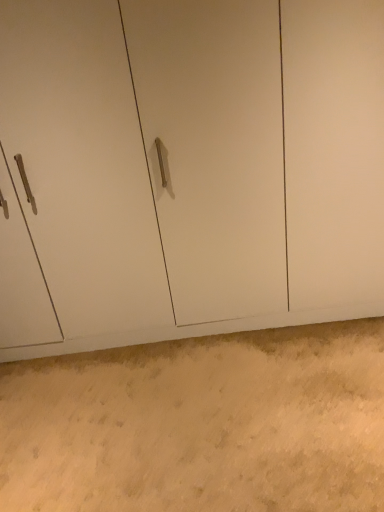
Image resolution: width=384 pixels, height=512 pixels. What do you see at coordinates (200, 424) in the screenshot?
I see `beige carpet at lower center` at bounding box center [200, 424].

Where is `beige carpet at lower center`? This screenshot has width=384, height=512. beige carpet at lower center is located at coordinates (200, 424).

Find the location of `beige carpet at lower center`. beige carpet at lower center is located at coordinates (200, 424).